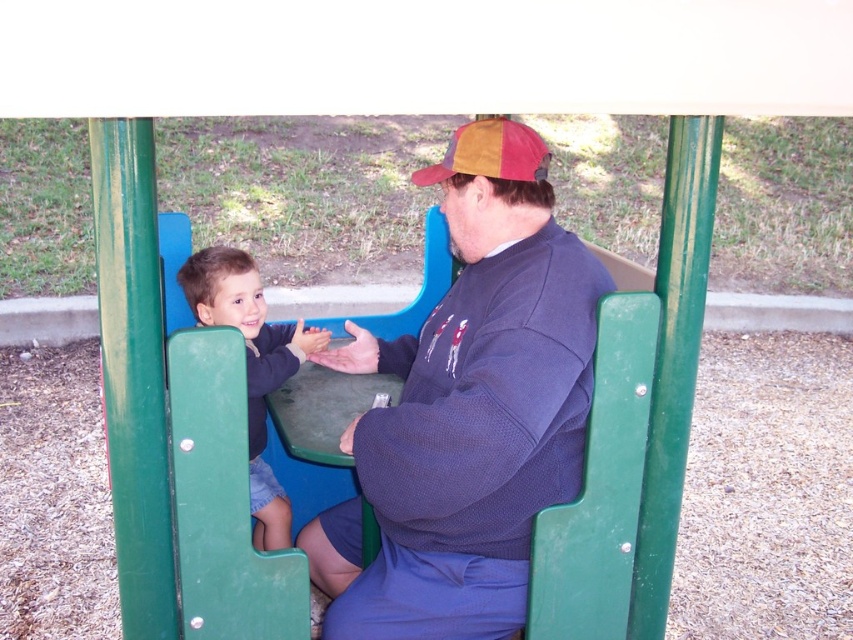
Between dark blue sweater at center and multicolored fabric baseball cap at upper center, which one appears on the left side from the viewer's perspective?

dark blue sweater at center

Which is in front, point (469, 500) or point (497, 154)?

Positioned in front is point (469, 500).

You are a GUI agent. You are given a task and a screenshot of the screen. Output one action in this format:
    pyautogui.click(x=<x>, y=<y>)
    Task: Click on the dark blue sweater at center
    
    Given the screenshot: What is the action you would take?
    pyautogui.click(x=467, y=410)

Can you confirm if dark blue sweater at center is smaller than matte blue shirt at left?

Incorrect, dark blue sweater at center is not smaller in size than matte blue shirt at left.

Describe the element at coordinates (467, 410) in the screenshot. I see `dark blue sweater at center` at that location.

Identify the location of dark blue sweater at center. (467, 410).

Can you confirm if matte blue shirt at left is thinner than multicolored fabric baseball cap at upper center?

Incorrect, matte blue shirt at left's width is not less than multicolored fabric baseball cap at upper center's.

Between matte blue shirt at left and multicolored fabric baseball cap at upper center, which one appears on the left side from the viewer's perspective?

matte blue shirt at left

Which is in front, point (210, 275) or point (427, 180)?

Point (427, 180)

Locate an element on the screen. The image size is (853, 640). matte blue shirt at left is located at coordinates (251, 365).